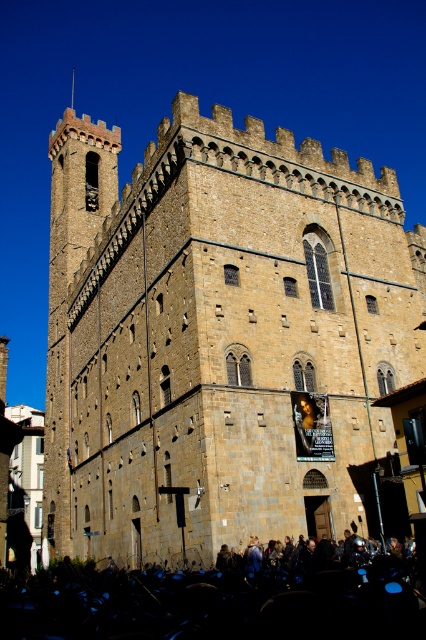
You are standing in front of the historic stone building. You want to take a photo of the brown stone castle at center and the black matte crowd at lower center. Which object should you focus on first to ensure both are in sharp focus?

You should focus on the brown stone castle at center first because it is closer to you than the black matte crowd at lower center, so focusing on the closer object will help both be in focus.

You are standing in front of a historic stone building and want to take a photo that includes the brown stone castle at center. Where should you position yourself to ensure the castle is centered in your frame?

To center the brown stone castle at center in your photo, position yourself directly in front of it, aligning your camera with the coordinates provided at point (218, 333).

You are standing in front of a historic stone building. There is a point marked at coordinates (218,333). Can you tell me what this point corresponds to on the building?

The point at coordinates (218,333) corresponds to the brown stone castle at center.